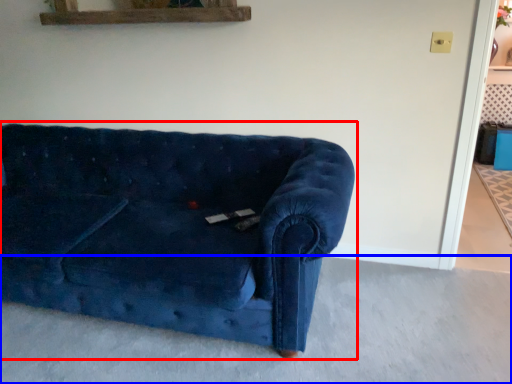
Question: Which object is further to the camera taking this photo, studio couch (highlighted by a red box) or concrete (highlighted by a blue box)?

Choices:
 (A) studio couch
 (B) concrete

Answer: (A)